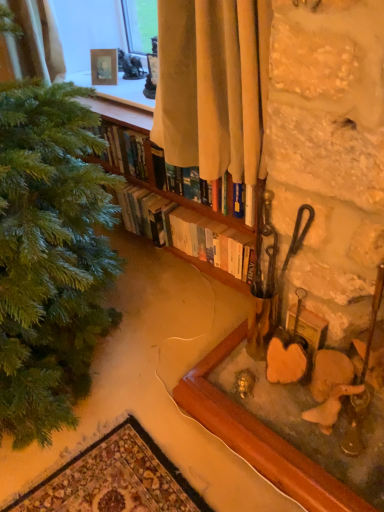
The height and width of the screenshot is (512, 384). What are the coordinates of `free region under beige fabric curtain at upper center (from a real-world perspective)` in the screenshot? It's located at (201, 301).